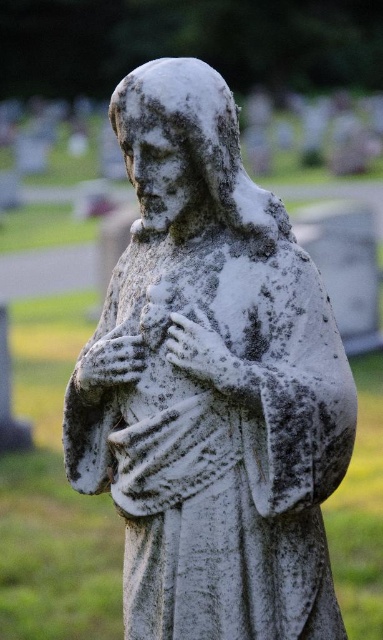
Question: In this image, where is white marble statue at center located relative to white stone hand at center?

Choices:
 (A) right
 (B) left

Answer: (B)

Question: Can you confirm if white marble statue at center is smaller than white stone hand at center?

Choices:
 (A) yes
 (B) no

Answer: (B)

Question: Is white marble statue at center further to camera compared to white stone hand at center?

Choices:
 (A) no
 (B) yes

Answer: (A)

Question: Which point is farther to the camera?

Choices:
 (A) (212, 358)
 (B) (245, 397)

Answer: (A)